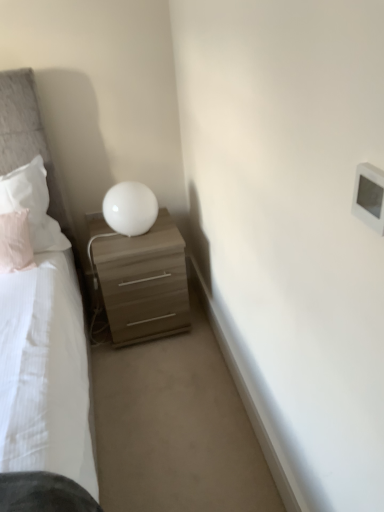
Image resolution: width=384 pixels, height=512 pixels. What do you see at coordinates (130, 208) in the screenshot?
I see `white glossy sphere at upper right` at bounding box center [130, 208].

Image resolution: width=384 pixels, height=512 pixels. What do you see at coordinates (369, 196) in the screenshot?
I see `white plastic light switch at upper right` at bounding box center [369, 196].

In order to click on white plastic light switch at upper right in this screenshot , I will do `click(369, 196)`.

Measure the distance between pink fabric pillow at left, which ranks as the second pillow in top-to-bottom order, and camera.

pink fabric pillow at left, which ranks as the second pillow in top-to-bottom order, and camera are 5.76 feet apart.

Where is `light brown wood nightstand at center`? The image size is (384, 512). light brown wood nightstand at center is located at coordinates point(143,282).

Is white plastic light switch at upper right oriented towards light brown wood nightstand at center?

No, white plastic light switch at upper right does not turn towards light brown wood nightstand at center.

In the image, is white plastic light switch at upper right on the left side or the right side of light brown wood nightstand at center?

white plastic light switch at upper right is positioned on light brown wood nightstand at center's right side.

How far apart are white plastic light switch at upper right and light brown wood nightstand at center?

white plastic light switch at upper right is 1.39 meters from light brown wood nightstand at center.

Is pink fabric pillow at left, which ranks as the second pillow in top-to-bottom order, at the left side of white glossy sphere at upper right?

Indeed, pink fabric pillow at left, which ranks as the second pillow in top-to-bottom order, is positioned on the left side of white glossy sphere at upper right.

From a real-world perspective, which object stands above the other?

From a 3D spatial view, white glossy sphere at upper right is above.

Which is behind, pink fabric pillow at left, the 1th pillow in the bottom-to-top sequence, or white glossy sphere at upper right?

white glossy sphere at upper right is further away from the camera.

Would you say white glossy sphere at upper right is part of pink fabric pillow at left, the 1th pillow in the bottom-to-top sequence,'s contents?

That's incorrect, white glossy sphere at upper right is not inside pink fabric pillow at left, the 1th pillow in the bottom-to-top sequence.

Is light brown wood nightstand at center in contact with white soft pillow at left, acting as the 1th pillow starting from the top?

light brown wood nightstand at center and white soft pillow at left, acting as the 1th pillow starting from the top, are not in contact.

Which point is more forward, (115, 266) or (22, 189)?

The point (115, 266) is more forward.

Measure the distance from light brown wood nightstand at center to white soft pillow at left, which appears as the second pillow when ordered from the bottom.

light brown wood nightstand at center and white soft pillow at left, which appears as the second pillow when ordered from the bottom, are 15.70 inches apart.

Looking at this image, does light brown wood nightstand at center have a greater width compared to white soft pillow at left, acting as the 1th pillow starting from the top?

Correct, the width of light brown wood nightstand at center exceeds that of white soft pillow at left, acting as the 1th pillow starting from the top.

Which is farther from the camera, (40, 175) or (373, 180)?

The point (40, 175) is more distant.

In the scene shown: Is the position of white soft pillow at left, acting as the 1th pillow starting from the top, less distant than that of white plastic light switch at upper right?

That is False.

You are a GUI agent. You are given a task and a screenshot of the screen. Output one action in this format:
    pyautogui.click(x=<x>, y=<y>)
    Task: Click on the light switch below the white soft pillow at left, acting as the 1th pillow starting from the top (from the image's perspective)
    
    Given the screenshot: What is the action you would take?
    pyautogui.click(x=369, y=196)

Considering the relative sizes of white soft pillow at left, which appears as the second pillow when ordered from the bottom, and white plastic light switch at upper right in the image provided, is white soft pillow at left, which appears as the second pillow when ordered from the bottom, thinner than white plastic light switch at upper right?

No, white soft pillow at left, which appears as the second pillow when ordered from the bottom, is not thinner than white plastic light switch at upper right.

This screenshot has height=512, width=384. In order to click on the 2nd pillow in front of the light brown wood nightstand at center in this screenshot , I will do `click(15, 242)`.

Which object is positioned more to the left, pink fabric pillow at left, which ranks as the second pillow in top-to-bottom order, or light brown wood nightstand at center?

pink fabric pillow at left, which ranks as the second pillow in top-to-bottom order.

Looking at this image, would you say light brown wood nightstand at center contains white glossy sphere at upper right?

No.

Based on the photo, is light brown wood nightstand at center aimed at white glossy sphere at upper right?

No, light brown wood nightstand at center is not aimed at white glossy sphere at upper right.

From a real-world perspective, which object rests below the other?

light brown wood nightstand at center.

From the image's perspective, between white glossy sphere at upper right and white soft pillow at left, acting as the 1th pillow starting from the top, which one is located above?

From the image's view, white glossy sphere at upper right is above.

From a real-world perspective, who is located higher, white glossy sphere at upper right or white soft pillow at left, acting as the 1th pillow starting from the top?

white soft pillow at left, acting as the 1th pillow starting from the top, is physically above.

Does white glossy sphere at upper right come in front of white soft pillow at left, which appears as the second pillow when ordered from the bottom?

No, white glossy sphere at upper right is further to the viewer.

From the picture: Is white glossy sphere at upper right beside white soft pillow at left, acting as the 1th pillow starting from the top?

There is a gap between white glossy sphere at upper right and white soft pillow at left, acting as the 1th pillow starting from the top.

The image size is (384, 512). I want to click on light switch that is in front of the light brown wood nightstand at center, so click(x=369, y=196).

Where is `pillow below the white glossy sphere at upper right (from a real-world perspective)`? The image size is (384, 512). pillow below the white glossy sphere at upper right (from a real-world perspective) is located at coordinates tap(15, 242).

Based on their spatial positions, is white plastic light switch at upper right or light brown wood nightstand at center closer to white soft pillow at left, which appears as the second pillow when ordered from the bottom?

light brown wood nightstand at center is positioned closer to the anchor white soft pillow at left, which appears as the second pillow when ordered from the bottom.

Estimate the real-world distances between objects in this image. Which object is closer to white soft pillow at left, acting as the 1th pillow starting from the top, white glossy sphere at upper right or light brown wood nightstand at center?

The object closer to white soft pillow at left, acting as the 1th pillow starting from the top, is white glossy sphere at upper right.

Estimate the real-world distances between objects in this image. Which object is closer to white glossy sphere at upper right, white plastic light switch at upper right or light brown wood nightstand at center?

Based on the image, light brown wood nightstand at center appears to be nearer to white glossy sphere at upper right.

Looking at this image, from the image, which object appears to be farther from white soft pillow at left, which appears as the second pillow when ordered from the bottom, light brown wood nightstand at center or pink fabric pillow at left, which ranks as the second pillow in top-to-bottom order?

light brown wood nightstand at center is further to white soft pillow at left, which appears as the second pillow when ordered from the bottom.

Based on the photo, which object lies further to the anchor point white soft pillow at left, which appears as the second pillow when ordered from the bottom, light brown wood nightstand at center or white plastic light switch at upper right?

white plastic light switch at upper right.

Based on their spatial positions, is white glossy sphere at upper right or white plastic light switch at upper right further from light brown wood nightstand at center?

white plastic light switch at upper right is further to light brown wood nightstand at center.

Considering their positions, is white glossy sphere at upper right positioned further to white soft pillow at left, acting as the 1th pillow starting from the top, than pink fabric pillow at left, which ranks as the second pillow in top-to-bottom order?

white glossy sphere at upper right is further to white soft pillow at left, acting as the 1th pillow starting from the top.

Considering their positions, is white soft pillow at left, acting as the 1th pillow starting from the top, positioned further to white glossy sphere at upper right than light brown wood nightstand at center?

Based on the image, white soft pillow at left, acting as the 1th pillow starting from the top, appears to be further to white glossy sphere at upper right.

Locate an element on the screen. pillow between pink fabric pillow at left, the 1th pillow in the bottom-to-top sequence, and white glossy sphere at upper right is located at coordinates (33, 205).

Where is `table lamp between pink fabric pillow at left, which ranks as the second pillow in top-to-bottom order, and light brown wood nightstand at center from left to right`? The width and height of the screenshot is (384, 512). table lamp between pink fabric pillow at left, which ranks as the second pillow in top-to-bottom order, and light brown wood nightstand at center from left to right is located at coordinates (130, 208).

This screenshot has width=384, height=512. What are the coordinates of `table lamp located between white plastic light switch at upper right and light brown wood nightstand at center in the depth direction` in the screenshot? It's located at (130, 208).

You are a GUI agent. You are given a task and a screenshot of the screen. Output one action in this format:
    pyautogui.click(x=<x>, y=<y>)
    Task: Click on the pillow situated between pink fabric pillow at left, which ranks as the second pillow in top-to-bottom order, and light brown wood nightstand at center from left to right
    The image size is (384, 512).
    Given the screenshot: What is the action you would take?
    tap(33, 205)